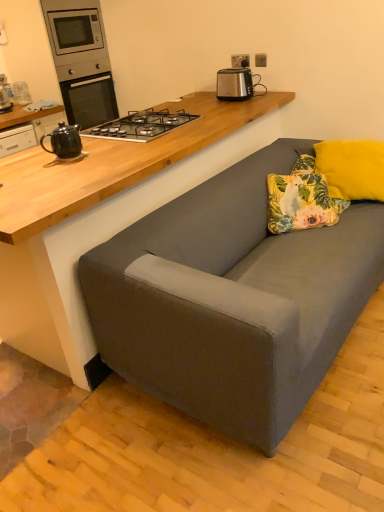
The width and height of the screenshot is (384, 512). Find the location of `vacant area to the right of satin silver toaster at upper center`. vacant area to the right of satin silver toaster at upper center is located at coordinates (276, 93).